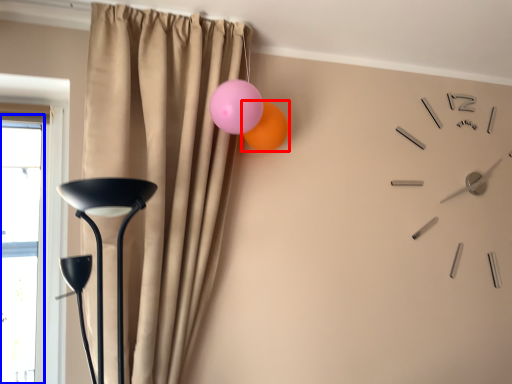
Question: Which of the following is the farthest to the observer, balloon (highlighted by a red box) or window (highlighted by a blue box)?

Choices:
 (A) balloon
 (B) window

Answer: (A)